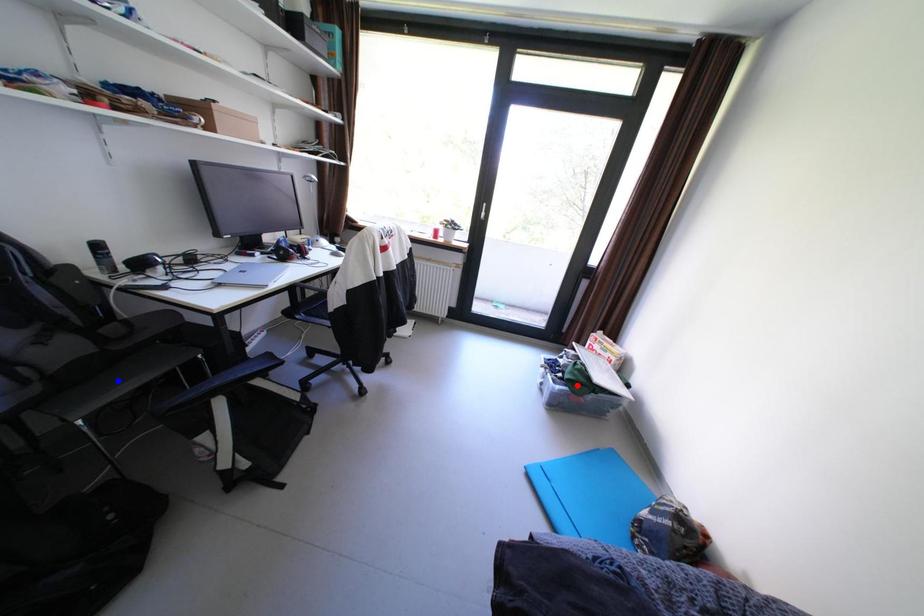
Question: In the image, two points are highlighted. Which point is nearer to the camera? Reply with the corresponding letter.

Choices:
 (A) blue point
 (B) red point

Answer: (A)